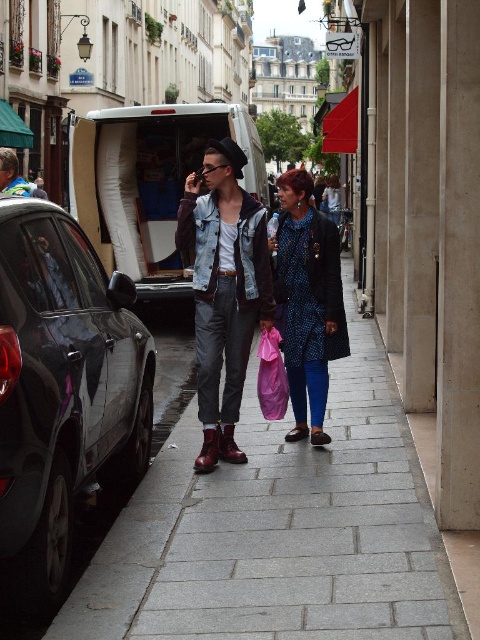
Who is more forward, (50, 429) or (204, 266)?

Point (50, 429) is in front.

Between shiny black car at left and matte leather jacket at center, which one appears on the left side from the viewer's perspective?

From the viewer's perspective, shiny black car at left appears more on the left side.

Image resolution: width=480 pixels, height=640 pixels. In order to click on shiny black car at left in this screenshot , I will do `click(61, 392)`.

Is point (207, 552) behind point (144, 248)?

That is False.

Is gray stone pavement at center above white matte van at center?

Actually, gray stone pavement at center is below white matte van at center.

This screenshot has height=640, width=480. Identify the location of gray stone pavement at center. (279, 529).

This screenshot has height=640, width=480. In order to click on gray stone pavement at center in this screenshot , I will do `click(279, 529)`.

Which of these two, gray stone pavement at center or blue dotted dress at center, stands taller?

blue dotted dress at center

Does gray stone pavement at center have a greater height compared to blue dotted dress at center?

Incorrect, gray stone pavement at center's height is not larger of blue dotted dress at center's.

Is point (184, 456) more distant than point (310, 346)?

No, (184, 456) is closer to viewer.

Image resolution: width=480 pixels, height=640 pixels. I want to click on gray stone pavement at center, so click(279, 529).